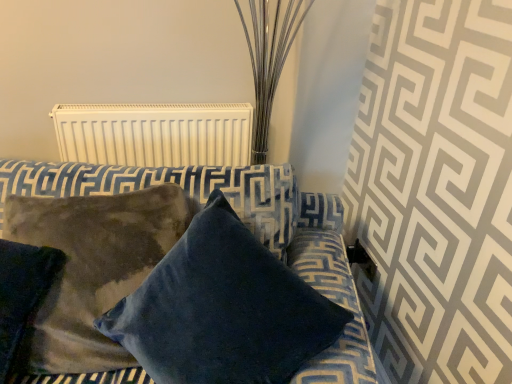
I want to click on suede-like brown pillow at lower left, which is counted as the second pillow, starting from the right, so click(22, 297).

Between suede-like brown pillow at lower left, which is counted as the second pillow, starting from the right, and velvet blue pillow at center, arranged as the first pillow when viewed from the right, which one has larger size?

velvet blue pillow at center, arranged as the first pillow when viewed from the right, is bigger.

Does point (30, 318) come closer to viewer compared to point (181, 379)?

No, (30, 318) is behind (181, 379).

From a real-world perspective, who is located higher, suede-like brown pillow at lower left, which is counted as the second pillow, starting from the right, or velvet blue pillow at center, which ranks as the 2th pillow in left-to-right order?

velvet blue pillow at center, which ranks as the 2th pillow in left-to-right order, is physically above.

At what (x,y) coordinates should I click in order to perform the action: click on the 1st pillow directly beneath the white matte radiator at upper center (from a real-world perspective). Please return your answer as a coordinate pair (x, y). Looking at the image, I should click on (223, 310).

Who is smaller, velvet blue pillow at center, which ranks as the 2th pillow in left-to-right order, or white matte radiator at upper center?

white matte radiator at upper center.

Considering the sizes of objects velvet blue pillow at center, arranged as the first pillow when viewed from the right, and white matte radiator at upper center in the image provided, who is thinner, velvet blue pillow at center, arranged as the first pillow when viewed from the right, or white matte radiator at upper center?

Thinner between the two is white matte radiator at upper center.

From the image's perspective, which object appears higher, velvet blue pillow at center, which ranks as the 2th pillow in left-to-right order, or white matte radiator at upper center?

white matte radiator at upper center, from the image's perspective.

Considering the sizes of white matte radiator at upper center and velvet blue pillow at center, which ranks as the 2th pillow in left-to-right order, in the image, is white matte radiator at upper center wider or thinner than velvet blue pillow at center, which ranks as the 2th pillow in left-to-right order,?

Clearly, white matte radiator at upper center has less width compared to velvet blue pillow at center, which ranks as the 2th pillow in left-to-right order.

Is white matte radiator at upper center taller or shorter than velvet blue pillow at center, arranged as the first pillow when viewed from the right?

white matte radiator at upper center is shorter than velvet blue pillow at center, arranged as the first pillow when viewed from the right.

Where is `radiator that appears above the velvet blue pillow at center, arranged as the first pillow when viewed from the right (from a real-world perspective)`? The width and height of the screenshot is (512, 384). radiator that appears above the velvet blue pillow at center, arranged as the first pillow when viewed from the right (from a real-world perspective) is located at coordinates (155, 134).

From the image's perspective, which is below, white matte radiator at upper center or velvet blue pillow at center, which ranks as the 2th pillow in left-to-right order?

velvet blue pillow at center, which ranks as the 2th pillow in left-to-right order.

Is velvet blue pillow at center, which ranks as the 2th pillow in left-to-right order, turned away from suede-like brown pillow at lower left, placed as the first pillow when sorted from left to right?

No.

From a real-world perspective, is velvet blue pillow at center, arranged as the first pillow when viewed from the right, positioned above or below suede-like brown pillow at lower left, placed as the first pillow when sorted from left to right?

From a real-world perspective, velvet blue pillow at center, arranged as the first pillow when viewed from the right, is physically above suede-like brown pillow at lower left, placed as the first pillow when sorted from left to right.

Between velvet blue pillow at center, arranged as the first pillow when viewed from the right, and suede-like brown pillow at lower left, placed as the first pillow when sorted from left to right, which one has more height?

velvet blue pillow at center, arranged as the first pillow when viewed from the right, is taller.

Is suede-like brown pillow at lower left, which is counted as the second pillow, starting from the right, to the left or to the right of white matte radiator at upper center in the image?

In the image, suede-like brown pillow at lower left, which is counted as the second pillow, starting from the right, appears on the left side of white matte radiator at upper center.

Would you say suede-like brown pillow at lower left, placed as the first pillow when sorted from left to right, is inside or outside white matte radiator at upper center?

suede-like brown pillow at lower left, placed as the first pillow when sorted from left to right, is outside white matte radiator at upper center.

From a real-world perspective, is suede-like brown pillow at lower left, placed as the first pillow when sorted from left to right, above or below white matte radiator at upper center?

Clearly, from a real-world perspective, suede-like brown pillow at lower left, placed as the first pillow when sorted from left to right, is below white matte radiator at upper center.

Between suede-like brown pillow at lower left, which is counted as the second pillow, starting from the right, and white matte radiator at upper center, which one has smaller width?

Thinner between the two is white matte radiator at upper center.

Which object is thinner, white matte radiator at upper center or suede-like brown pillow at lower left, placed as the first pillow when sorted from left to right?

Thinner between the two is white matte radiator at upper center.

Considering the relative positions of white matte radiator at upper center and suede-like brown pillow at lower left, placed as the first pillow when sorted from left to right, in the image provided, is white matte radiator at upper center to the right of suede-like brown pillow at lower left, placed as the first pillow when sorted from left to right, from the viewer's perspective?

Yes, white matte radiator at upper center is to the right of suede-like brown pillow at lower left, placed as the first pillow when sorted from left to right.

Is white matte radiator at upper center positioned with its back to suede-like brown pillow at lower left, placed as the first pillow when sorted from left to right?

white matte radiator at upper center is not turned away from suede-like brown pillow at lower left, placed as the first pillow when sorted from left to right.

Based on the photo, is the position of white matte radiator at upper center more distant than that of suede-like brown pillow at lower left, placed as the first pillow when sorted from left to right?

Yes, white matte radiator at upper center is further from the viewer.

Locate an element on the screen. pillow above the suede-like brown pillow at lower left, placed as the first pillow when sorted from left to right (from a real-world perspective) is located at coordinates (223, 310).

This screenshot has height=384, width=512. I want to click on radiator behind the velvet blue pillow at center, arranged as the first pillow when viewed from the right, so click(155, 134).

Which object lies further to the anchor point white matte radiator at upper center, velvet blue pillow at center, arranged as the first pillow when viewed from the right, or suede-like brown pillow at lower left, placed as the first pillow when sorted from left to right?

velvet blue pillow at center, arranged as the first pillow when viewed from the right, lies further to white matte radiator at upper center than the other object.

Based on their spatial positions, is suede-like brown pillow at lower left, placed as the first pillow when sorted from left to right, or velvet blue pillow at center, which ranks as the 2th pillow in left-to-right order, further from white matte radiator at upper center?

velvet blue pillow at center, which ranks as the 2th pillow in left-to-right order.

Based on their spatial positions, is white matte radiator at upper center or suede-like brown pillow at lower left, which is counted as the second pillow, starting from the right, closer to velvet blue pillow at center, arranged as the first pillow when viewed from the right?

Based on the image, suede-like brown pillow at lower left, which is counted as the second pillow, starting from the right, appears to be nearer to velvet blue pillow at center, arranged as the first pillow when viewed from the right.

Based on their spatial positions, is white matte radiator at upper center or velvet blue pillow at center, which ranks as the 2th pillow in left-to-right order, further from suede-like brown pillow at lower left, which is counted as the second pillow, starting from the right?

Based on the image, white matte radiator at upper center appears to be further to suede-like brown pillow at lower left, which is counted as the second pillow, starting from the right.

Based on their spatial positions, is velvet blue pillow at center, which ranks as the 2th pillow in left-to-right order, or white matte radiator at upper center closer to suede-like brown pillow at lower left, which is counted as the second pillow, starting from the right?

Based on the image, velvet blue pillow at center, which ranks as the 2th pillow in left-to-right order, appears to be nearer to suede-like brown pillow at lower left, which is counted as the second pillow, starting from the right.

Based on their spatial positions, is suede-like brown pillow at lower left, which is counted as the second pillow, starting from the right, or white matte radiator at upper center closer to velvet blue pillow at center, which ranks as the 2th pillow in left-to-right order?

suede-like brown pillow at lower left, which is counted as the second pillow, starting from the right.

In order to click on pillow between velvet blue pillow at center, which ranks as the 2th pillow in left-to-right order, and white matte radiator at upper center from front to back in this screenshot , I will do `click(22, 297)`.